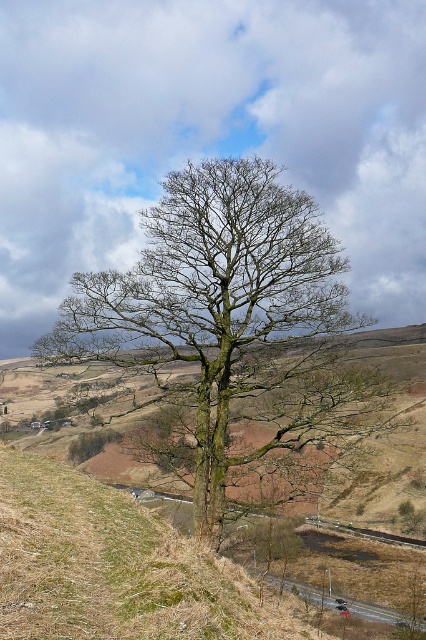
Is green mossy tree at center to the right of green mossy grass at center from the viewer's perspective?

Yes, green mossy tree at center is to the right of green mossy grass at center.

Does green mossy tree at center have a lesser height compared to green mossy grass at center?

In fact, green mossy tree at center may be taller than green mossy grass at center.

What do you see at coordinates (233, 337) in the screenshot? The width and height of the screenshot is (426, 640). I see `green mossy tree at center` at bounding box center [233, 337].

Find the location of a particular element. Image resolution: width=426 pixels, height=640 pixels. green mossy tree at center is located at coordinates (233, 337).